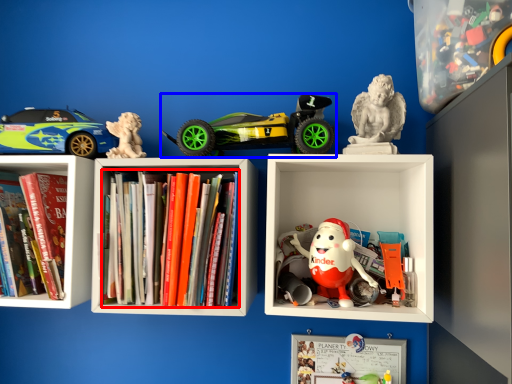
Question: Which object is further to the camera taking this photo, book (highlighted by a red box) or toy (highlighted by a blue box)?

Choices:
 (A) book
 (B) toy

Answer: (B)